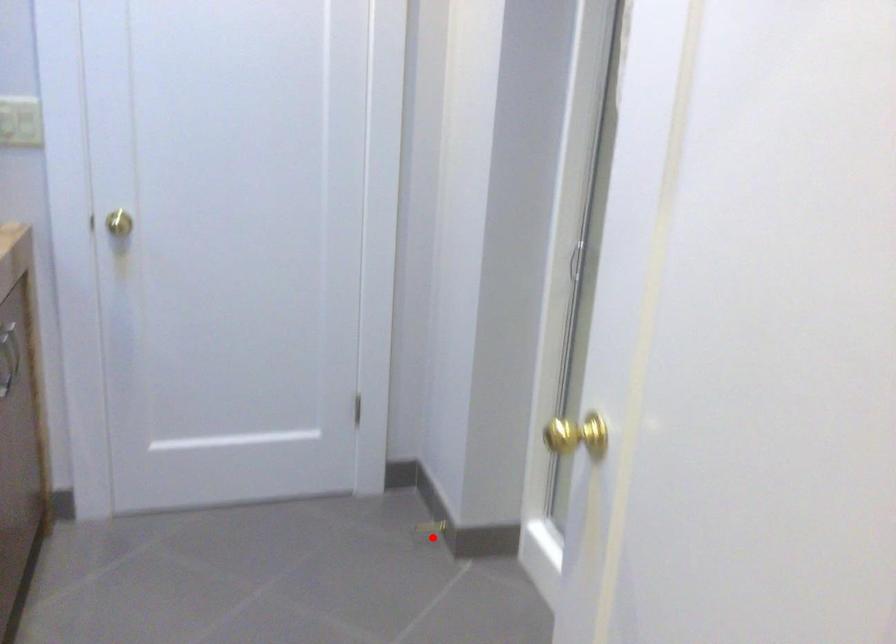
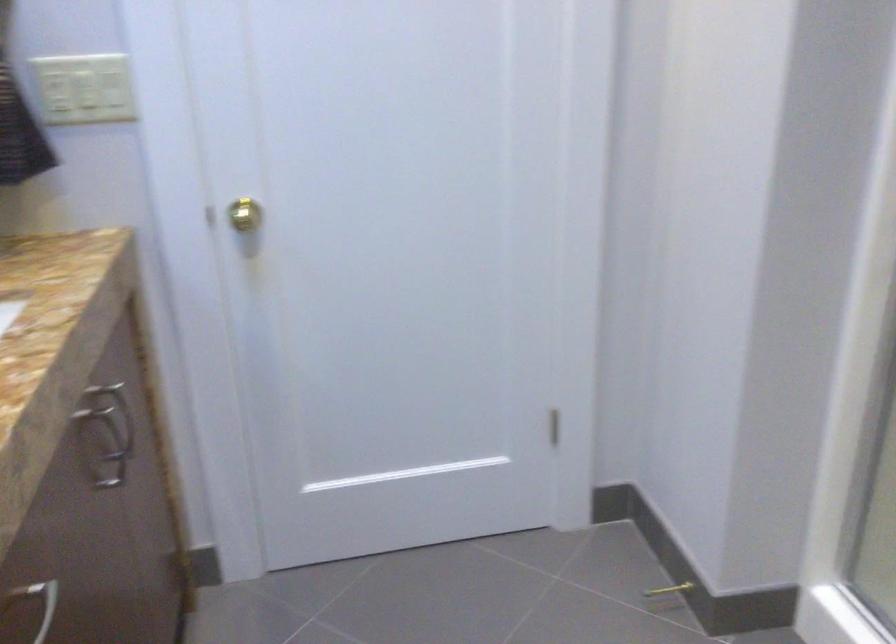
Question: I am providing you with two images of the same scene from different viewpoints. A red point is shown in image1. For the corresponding object point in image2, is it positioned nearer or farther from the camera?

Choices:
 (A) Nearer
 (B) Farther

Answer: (A)